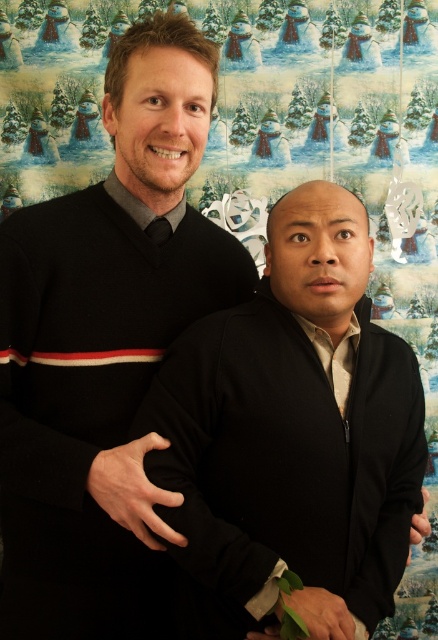
Question: Which point appears farthest from the camera in this image?

Choices:
 (A) (16, 278)
 (B) (392, 518)

Answer: (B)

Question: Can you confirm if black matte sweater at left is bigger than black matte sweater at center?

Choices:
 (A) no
 (B) yes

Answer: (B)

Question: Which object is closer to the camera taking this photo?

Choices:
 (A) black matte sweater at center
 (B) black matte sweater at left

Answer: (A)

Question: Among these points, which one is farthest from the camera?

Choices:
 (A) (70, 268)
 (B) (350, 268)

Answer: (A)

Question: Does black matte sweater at left have a greater width compared to black matte sweater at center?

Choices:
 (A) yes
 (B) no

Answer: (B)

Question: Does black matte sweater at left have a greater width compared to black matte sweater at center?

Choices:
 (A) yes
 (B) no

Answer: (B)